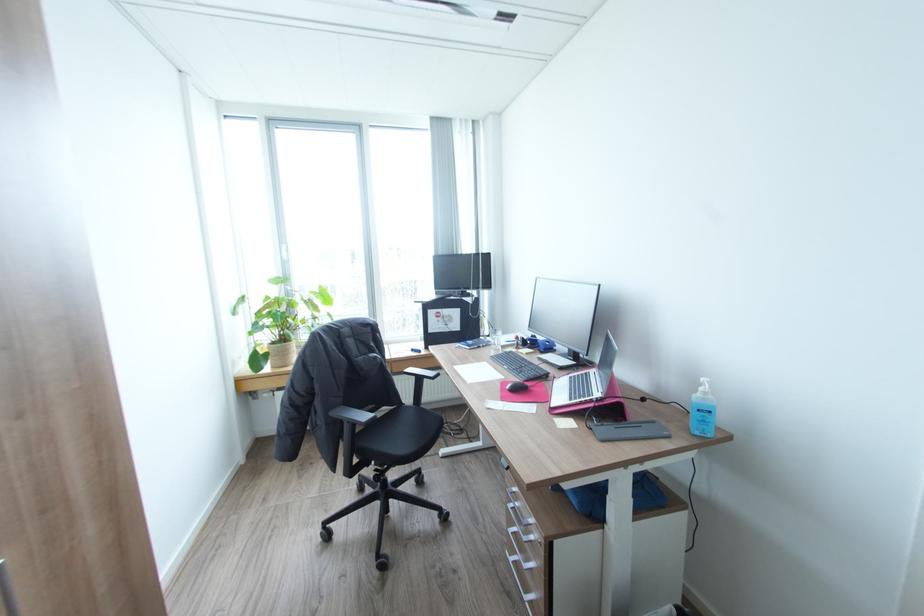
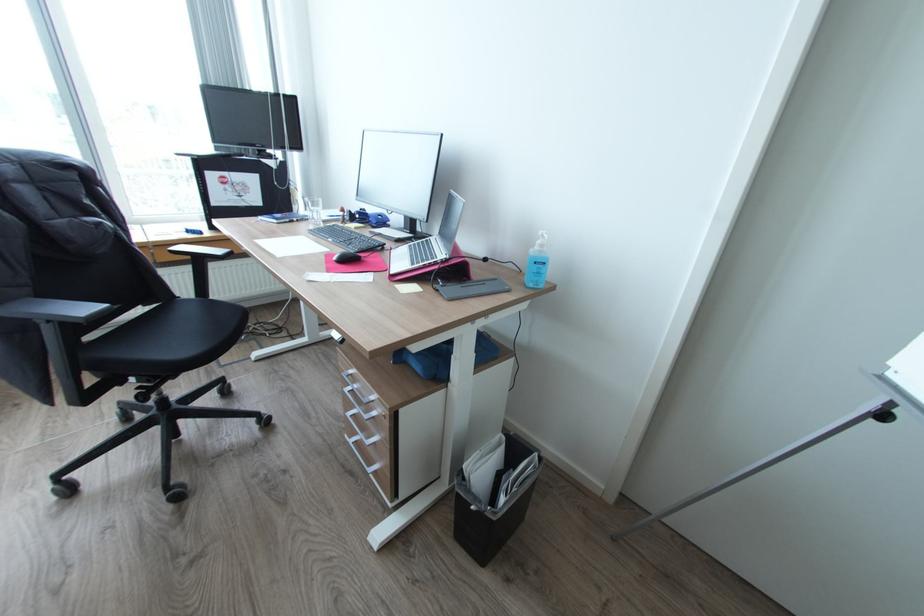
The point at (x=590, y=373) is marked in the first image. Where is the corresponding point in the second image?

(432, 238)